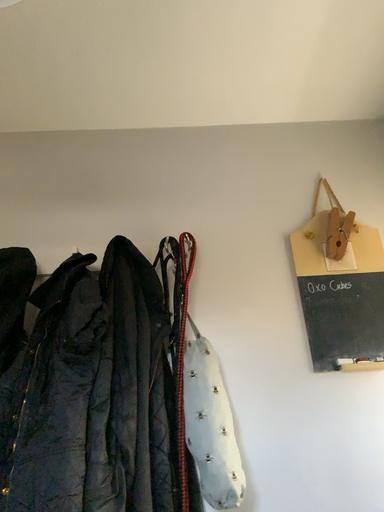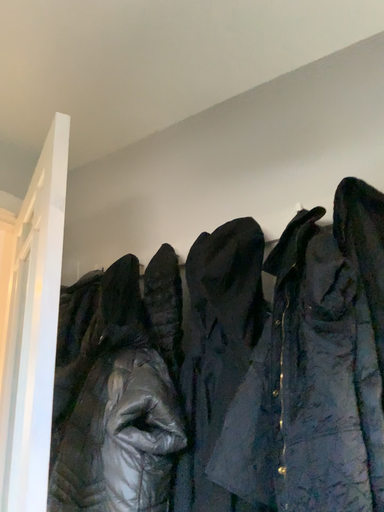
Question: How did the camera likely rotate when shooting the video?

Choices:
 (A) rotated upward
 (B) rotated downward

Answer: (B)